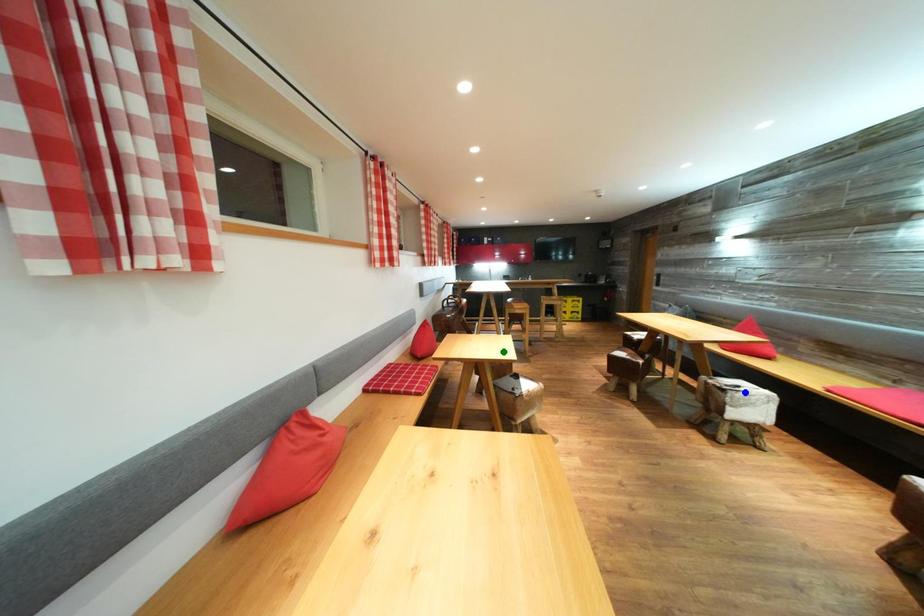
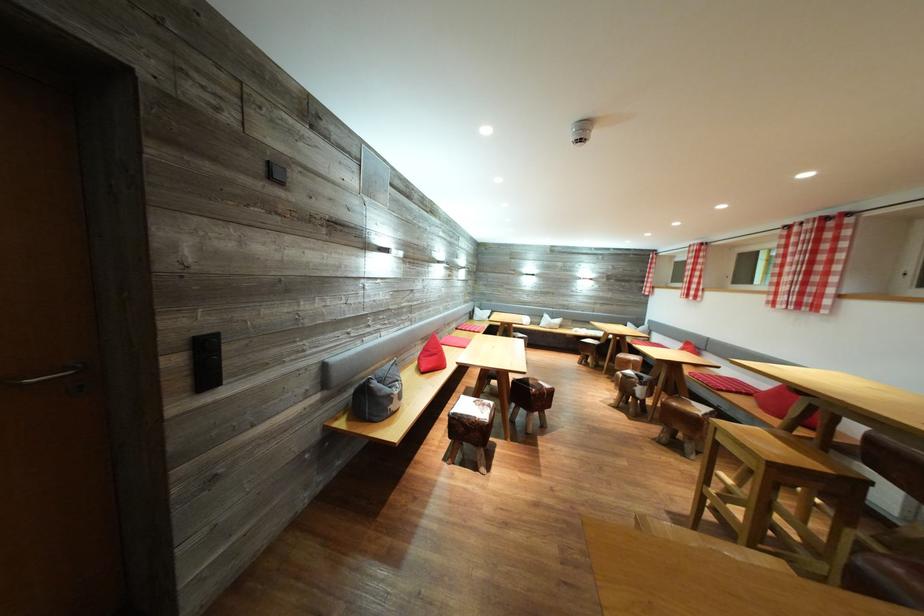
I am providing you with two images of the same scene from different viewpoints. Three points are marked in image1. Which point corresponds to a part or object that is occluded in image2?In image1, three points are marked. Which of them correspond to a part or object that is occluded in image2?Among the three points shown in image1, which one corresponds to a part or object that is no longer visible due to occlusion in image2?

Invisible in image2: yellow point, blue point, green point.